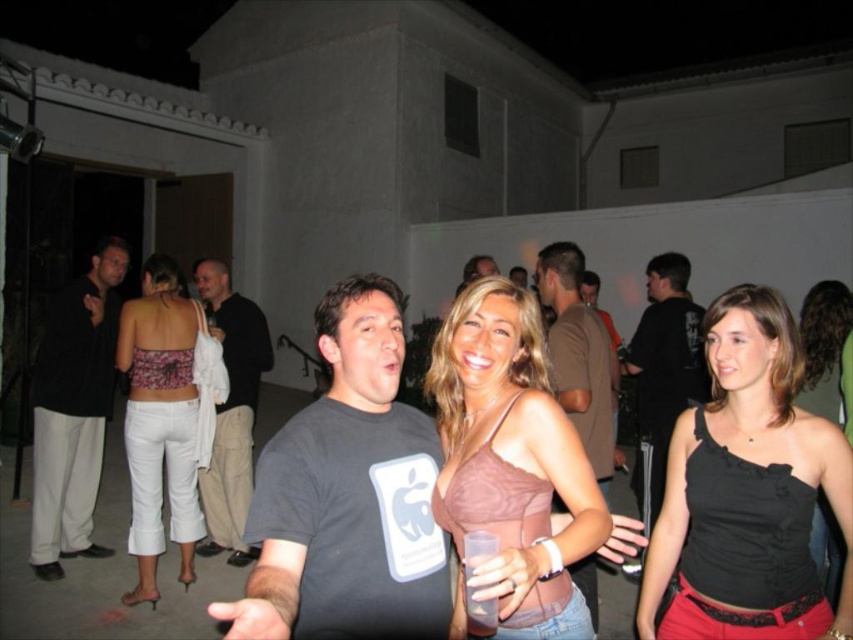
Who is shorter, black satin tank top at center or pink satin tank top at center?

Standing shorter between the two is pink satin tank top at center.

Which is in front, point (723, 353) or point (512, 564)?

Positioned in front is point (512, 564).

You are a GUI agent. You are given a task and a screenshot of the screen. Output one action in this format:
    pyautogui.click(x=<x>, y=<y>)
    Task: Click on the black satin tank top at center
    The width and height of the screenshot is (853, 640).
    Given the screenshot: What is the action you would take?
    pyautogui.click(x=747, y=492)

The image size is (853, 640). I want to click on black satin tank top at center, so click(x=747, y=492).

Is gray matte t-shirt at center to the right of black cotton shirt at left from the viewer's perspective?

Correct, you'll find gray matte t-shirt at center to the right of black cotton shirt at left.

Is gray matte t-shirt at center above black cotton shirt at left?

Yes.

Describe the element at coordinates (339, 492) in the screenshot. I see `gray matte t-shirt at center` at that location.

Where is `gray matte t-shirt at center`? Image resolution: width=853 pixels, height=640 pixels. gray matte t-shirt at center is located at coordinates (339, 492).

Describe the element at coordinates (578, 355) in the screenshot. This screenshot has width=853, height=640. I see `brown cotton t-shirt at center` at that location.

Where is `brown cotton t-shirt at center`? The width and height of the screenshot is (853, 640). brown cotton t-shirt at center is located at coordinates (578, 355).